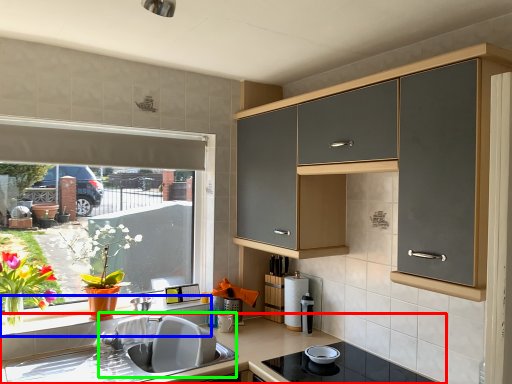
Question: Based on their relative distances, which object is nearer to countertop (highlighted by a red box)? Choose from window sill (highlighted by a blue box) and sink (highlighted by a green box).

Choices:
 (A) window sill
 (B) sink

Answer: (B)